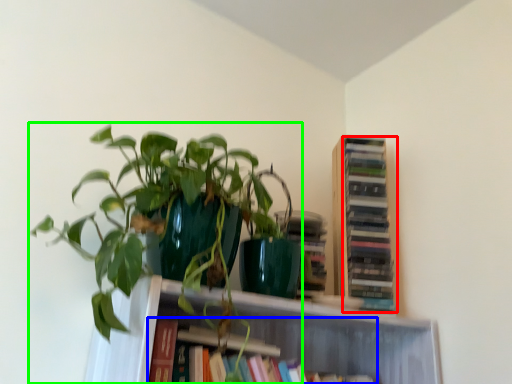
Question: Which object is positioned closest to book (highlighted by a red box)? Select from book (highlighted by a blue box) and houseplant (highlighted by a green box).

Choices:
 (A) book
 (B) houseplant

Answer: (A)